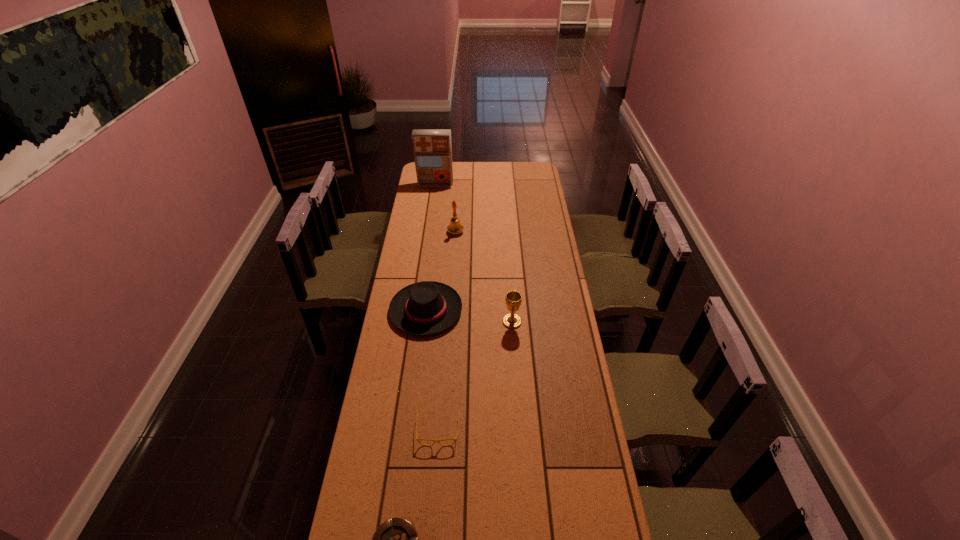
At what (x,y) coordinates should I click in order to perform the action: click on vacant space located on the right of the fifth shortest object. Please return your answer as a coordinate pair (x, y). The height and width of the screenshot is (540, 960). Looking at the image, I should click on (477, 232).

At what (x,y) coordinates should I click in order to perform the action: click on free space located 0.400m on the back of the rightmost object. Please return your answer as a coordinate pair (x, y). The width and height of the screenshot is (960, 540). Looking at the image, I should click on (508, 256).

In order to click on vacant space located 0.360m on the front of the dress hat in this screenshot , I will do `click(413, 416)`.

I want to click on vacant space located in front of the lenses of the second shortest object, so click(x=433, y=506).

The width and height of the screenshot is (960, 540). I want to click on the first-aid kit situated at the left edge, so click(432, 148).

You are a GUI agent. You are given a task and a screenshot of the screen. Output one action in this format:
    pyautogui.click(x=<x>, y=<y>)
    Task: Click on the dress hat present at the left edge
    
    Given the screenshot: What is the action you would take?
    pyautogui.click(x=424, y=308)

This screenshot has height=540, width=960. Find the location of `free space at the left edge of the desktop`. free space at the left edge of the desktop is located at coordinates (407, 447).

I want to click on free spot at the right edge of the desktop, so click(603, 475).

The width and height of the screenshot is (960, 540). Identify the location of unoccupied area between the bell and the first-aid kit. (445, 208).

Find the location of a particular element. The width and height of the screenshot is (960, 540). free space between the first-aid kit and the dress hat is located at coordinates (431, 248).